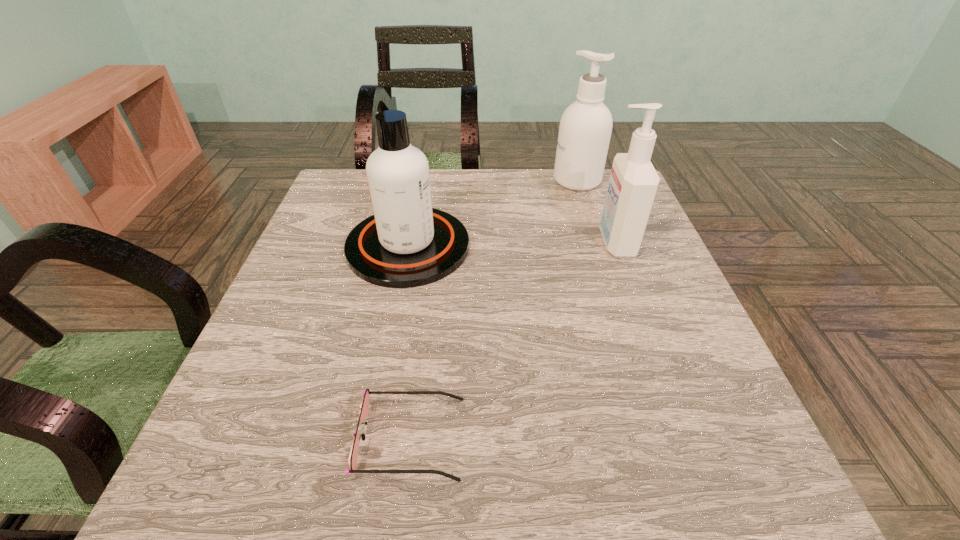
The width and height of the screenshot is (960, 540). Find the location of `unoccupied area between the farthest object and the sunglasses`. unoccupied area between the farthest object and the sunglasses is located at coordinates (493, 309).

The height and width of the screenshot is (540, 960). Find the location of `free space between the sunglasses and the farthest object`. free space between the sunglasses and the farthest object is located at coordinates (493, 309).

Identify the location of vacant area that lies between the shortest object and the leftmost cleansing agent. This screenshot has width=960, height=540. (409, 342).

Where is `free area in between the farthest object and the leftmost cleansing agent`? This screenshot has width=960, height=540. free area in between the farthest object and the leftmost cleansing agent is located at coordinates (492, 213).

In order to click on free point between the farthest object and the shortest object in this screenshot , I will do (493, 309).

Identify the location of free space that is in between the farthest cleansing agent and the leftmost cleansing agent. (492, 213).

Image resolution: width=960 pixels, height=540 pixels. In order to click on vacant space that's between the shortest object and the leftmost cleansing agent in this screenshot , I will do `click(409, 342)`.

Where is `blank region between the sunglasses and the farthest cleansing agent`? The width and height of the screenshot is (960, 540). blank region between the sunglasses and the farthest cleansing agent is located at coordinates (493, 309).

Locate which object is the closest to the farthest object. Please provide its 2D coordinates. Your answer should be formatted as a tuple, i.e. [(x, y)], where the tuple contains the x and y coordinates of a point satisfying the conditions above.

[(633, 183)]

Locate an element on the screen. This screenshot has width=960, height=540. the third closest object to the farthest object is located at coordinates (364, 407).